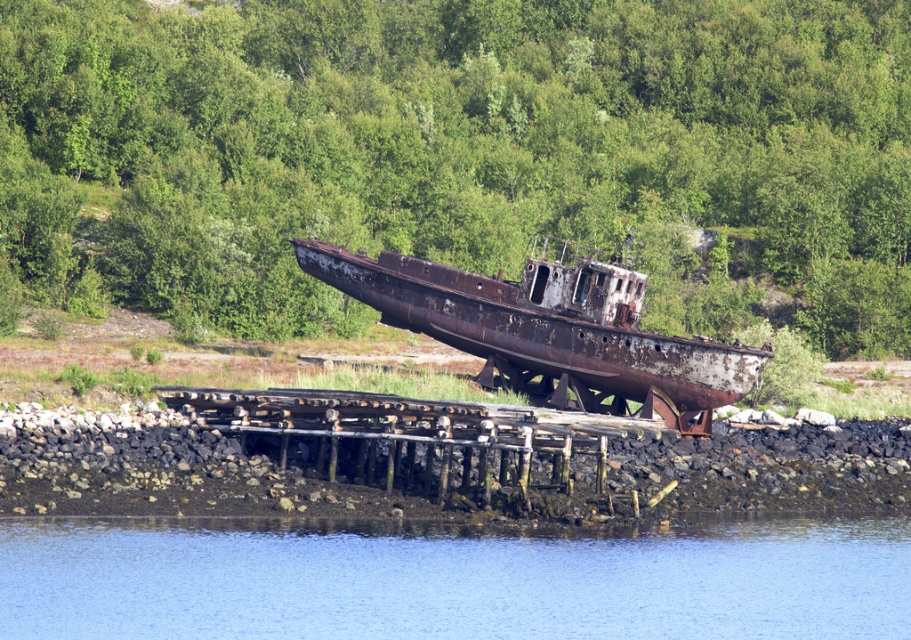
Question: Is green leafy trees at upper center below blue water at lower center?

Choices:
 (A) no
 (B) yes

Answer: (A)

Question: Is green leafy trees at upper center above blue water at lower center?

Choices:
 (A) no
 (B) yes

Answer: (B)

Question: Is green leafy trees at upper center to the right of blue water at lower center from the viewer's perspective?

Choices:
 (A) no
 (B) yes

Answer: (A)

Question: Based on their relative distances, which object is nearer to the blue water at lower center?

Choices:
 (A) green leafy trees at upper center
 (B) rusty metal boat at center

Answer: (B)

Question: Estimate the real-world distances between objects in this image. Which object is farther from the blue water at lower center?

Choices:
 (A) green leafy trees at upper center
 (B) rusty metal boat at center

Answer: (A)

Question: Which object appears closest to the camera in this image?

Choices:
 (A) blue water at lower center
 (B) green leafy trees at upper center
 (C) rusty metal boat at center

Answer: (A)